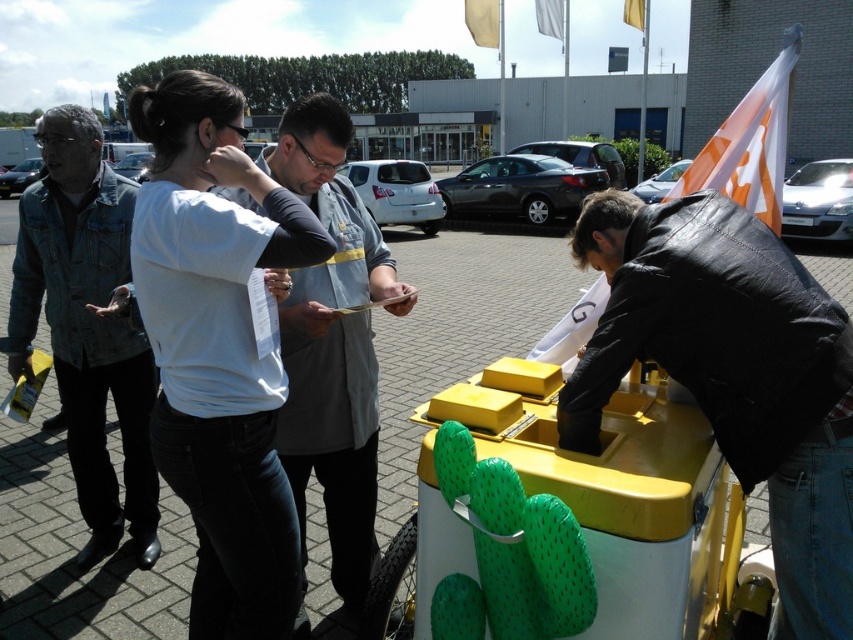
Question: Can you confirm if yellow plastic street vendor at right is bigger than white shirt at center?

Choices:
 (A) yes
 (B) no

Answer: (B)

Question: Considering the real-world distances, which object is closest to the yellow plastic street vendor at right?

Choices:
 (A) white shirt at center
 (B) denim jacket at left

Answer: (A)

Question: Which is farther from the yellow plastic street vendor at right?

Choices:
 (A) denim jacket at left
 (B) white shirt at center

Answer: (A)

Question: Can you confirm if yellow plastic street vendor at right is positioned above denim jacket at left?

Choices:
 (A) no
 (B) yes

Answer: (B)

Question: Can you confirm if yellow plastic street vendor at right is positioned below denim jacket at left?

Choices:
 (A) no
 (B) yes

Answer: (A)

Question: Which point is closer to the camera?

Choices:
 (A) (410, 304)
 (B) (786, 304)
 (C) (119, 221)

Answer: (B)